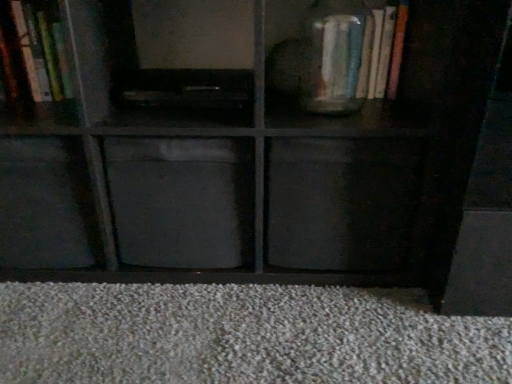
Question: Considering the relative sizes of black matte drawer at center and matte gray cabinet at center, positioned as the first cabinet in right-to-left order, in the image provided, is black matte drawer at center bigger than matte gray cabinet at center, positioned as the first cabinet in right-to-left order,?

Choices:
 (A) yes
 (B) no

Answer: (B)

Question: Is black matte drawer at center looking in the opposite direction of matte gray cabinet at center, which is the third cabinet in left-to-right order?

Choices:
 (A) no
 (B) yes

Answer: (A)

Question: Is black matte drawer at center wider than matte gray cabinet at center, positioned as the first cabinet in right-to-left order?

Choices:
 (A) yes
 (B) no

Answer: (B)

Question: From a real-world perspective, is black matte drawer at center under matte gray cabinet at center, which is the third cabinet in left-to-right order?

Choices:
 (A) yes
 (B) no

Answer: (A)

Question: From a real-world perspective, is black matte drawer at center physically above matte gray cabinet at center, which is the third cabinet in left-to-right order?

Choices:
 (A) yes
 (B) no

Answer: (B)

Question: Based on their sizes in the image, would you say wooden bookshelf at upper left, acting as the first cabinet starting from the left, is bigger or smaller than matte gray cabinet at center, positioned as the first cabinet in right-to-left order?

Choices:
 (A) small
 (B) big

Answer: (A)

Question: Is wooden bookshelf at upper left, acting as the 3th cabinet starting from the right, in front of or behind matte gray cabinet at center, which is the third cabinet in left-to-right order, in the image?

Choices:
 (A) behind
 (B) front

Answer: (A)

Question: In terms of height, does wooden bookshelf at upper left, acting as the 3th cabinet starting from the right, look taller or shorter compared to matte gray cabinet at center, positioned as the first cabinet in right-to-left order?

Choices:
 (A) short
 (B) tall

Answer: (A)

Question: Is wooden bookshelf at upper left, acting as the 3th cabinet starting from the right, wider or thinner than matte gray cabinet at center, which is the third cabinet in left-to-right order?

Choices:
 (A) thin
 (B) wide

Answer: (A)

Question: In terms of width, does matte gray cabinet at center, which is the third cabinet in left-to-right order, look wider or thinner when compared to wooden bookshelf at upper left, acting as the first cabinet starting from the left?

Choices:
 (A) wide
 (B) thin

Answer: (A)

Question: Based on their positions, is matte gray cabinet at center, which is the third cabinet in left-to-right order, located to the left or right of wooden bookshelf at upper left, acting as the 3th cabinet starting from the right?

Choices:
 (A) left
 (B) right

Answer: (B)

Question: From the image's perspective, is matte gray cabinet at center, which is the third cabinet in left-to-right order, located above or below wooden bookshelf at upper left, acting as the first cabinet starting from the left?

Choices:
 (A) above
 (B) below

Answer: (B)

Question: From a real-world perspective, is matte gray cabinet at center, positioned as the first cabinet in right-to-left order, above or below wooden bookshelf at upper left, acting as the first cabinet starting from the left?

Choices:
 (A) below
 (B) above

Answer: (A)

Question: Is matte gray cabinet at center, which is the third cabinet in left-to-right order, spatially inside black matte drawer at center, or outside of it?

Choices:
 (A) inside
 (B) outside

Answer: (B)

Question: From a real-world perspective, relative to black matte drawer at center, is matte gray cabinet at center, which is the third cabinet in left-to-right order, vertically above or below?

Choices:
 (A) above
 (B) below

Answer: (A)